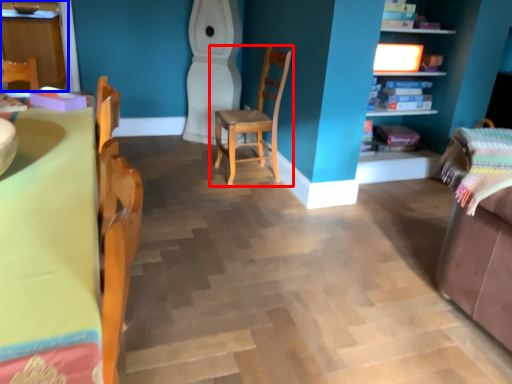
Question: Which object is further to the camera taking this photo, chair (highlighted by a red box) or cabinetry (highlighted by a blue box)?

Choices:
 (A) chair
 (B) cabinetry

Answer: (B)